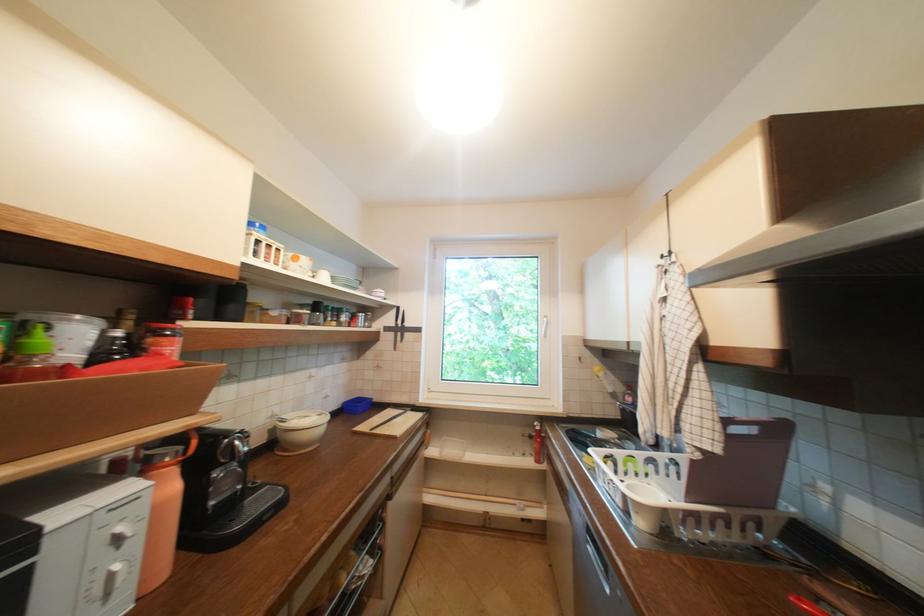
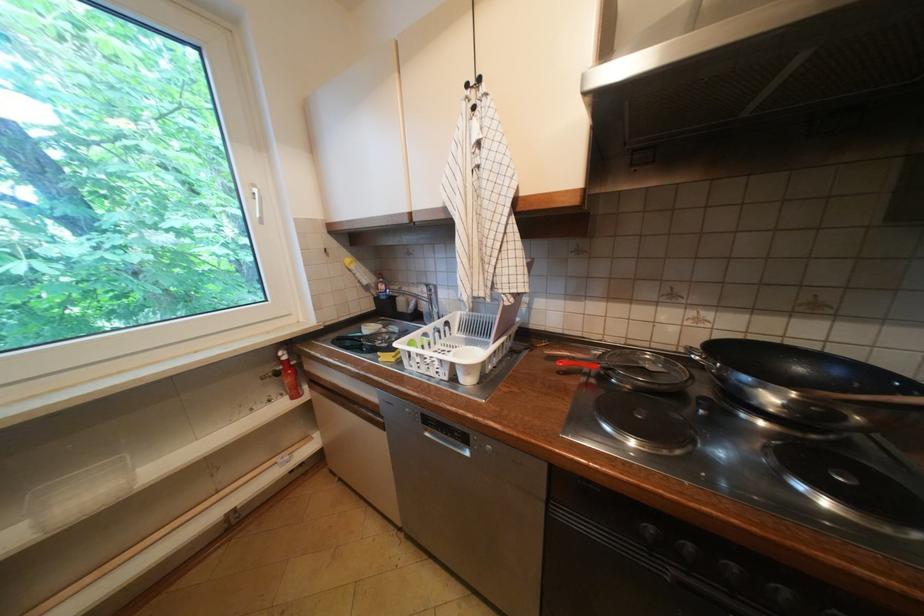
First-person continuous shooting, in which direction is the camera rotating?

The camera's rotation is toward right-down.